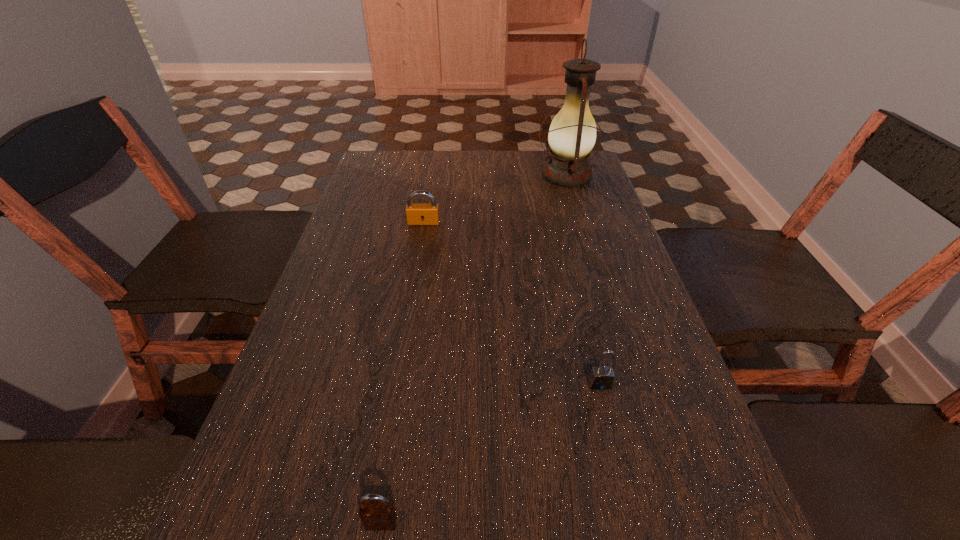
Where is `the farthest object`? The image size is (960, 540). the farthest object is located at coordinates (572, 134).

Find the location of a particular element. the tallest object is located at coordinates (572, 134).

Identify the location of the farthest padlock. The width and height of the screenshot is (960, 540). (x=416, y=214).

I want to click on the third farthest object, so click(602, 377).

Locate an element on the screen. The height and width of the screenshot is (540, 960). the rightmost padlock is located at coordinates (602, 377).

The image size is (960, 540). I want to click on the nearest object, so click(380, 515).

Where is `free location located 0.180m on the left of the oil lamp`? This screenshot has height=540, width=960. free location located 0.180m on the left of the oil lamp is located at coordinates (480, 176).

Identify the location of vacant space located 0.350m to unlock the second farthest object from the front. (407, 319).

This screenshot has height=540, width=960. Identify the location of vacant space located 0.080m on the shackle of the rightmost padlock. (612, 430).

Find the location of a particular element. object situated at the far edge is located at coordinates (572, 134).